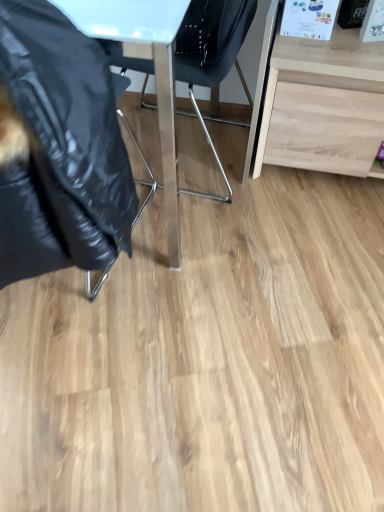
Locate an element on the screen. black glossy jacket at left, which ranks as the 2th chair in right-to-left order is located at coordinates (62, 151).

Looking at this image, does black glossy jacket at left, which ranks as the 2th chair in right-to-left order, have a smaller size compared to metallic blue chair at center, placed as the first chair when sorted from right to left?

Correct, black glossy jacket at left, which ranks as the 2th chair in right-to-left order, occupies less space than metallic blue chair at center, placed as the first chair when sorted from right to left.

Is black glossy jacket at left, which ranks as the 2th chair in right-to-left order, next to metallic blue chair at center, placed as the first chair when sorted from right to left, and touching it?

No, black glossy jacket at left, which ranks as the 2th chair in right-to-left order, is not making contact with metallic blue chair at center, placed as the first chair when sorted from right to left.

Does black glossy jacket at left, the first chair in the left-to-right sequence, have a greater width compared to metallic blue chair at center, placed as the first chair when sorted from right to left?

In fact, black glossy jacket at left, the first chair in the left-to-right sequence, might be narrower than metallic blue chair at center, placed as the first chair when sorted from right to left.

From the image's perspective, is black glossy jacket at left, which ranks as the 2th chair in right-to-left order, under light wood desk at right?

Yes, from the image's perspective, black glossy jacket at left, which ranks as the 2th chair in right-to-left order, is beneath light wood desk at right.

From a real-world perspective, is black glossy jacket at left, which ranks as the 2th chair in right-to-left order, located beneath light wood desk at right?

No, from a real-world perspective, black glossy jacket at left, which ranks as the 2th chair in right-to-left order, is not under light wood desk at right.

Are black glossy jacket at left, the first chair in the left-to-right sequence, and light wood desk at right located far from each other?

Actually, black glossy jacket at left, the first chair in the left-to-right sequence, and light wood desk at right are a little close together.

Considering the sizes of objects black glossy jacket at left, the first chair in the left-to-right sequence, and light wood desk at right in the image provided, who is smaller, black glossy jacket at left, the first chair in the left-to-right sequence, or light wood desk at right?

light wood desk at right is smaller.

Is light wood desk at right located outside black glossy jacket at left, which ranks as the 2th chair in right-to-left order?

Yes, light wood desk at right is located beyond the bounds of black glossy jacket at left, which ranks as the 2th chair in right-to-left order.

Looking at their sizes, would you say light wood desk at right is wider or thinner than black glossy jacket at left, the first chair in the left-to-right sequence?

light wood desk at right is wider than black glossy jacket at left, the first chair in the left-to-right sequence.

Can you tell me how much light wood desk at right and black glossy jacket at left, which ranks as the 2th chair in right-to-left order, differ in facing direction?

179 degrees.

Where is `the 2nd chair to the left when counting from the light wood desk at right`? the 2nd chair to the left when counting from the light wood desk at right is located at coordinates (62, 151).

Is metallic blue chair at center, arranged as the second chair when viewed from the left, inside or outside of light wood desk at right?

The correct answer is: outside.

Which of these two, metallic blue chair at center, placed as the first chair when sorted from right to left, or light wood desk at right, stands shorter?

light wood desk at right is shorter.

In the scene shown: Is the position of metallic blue chair at center, placed as the first chair when sorted from right to left, more distant than that of light wood desk at right?

No, the depth of metallic blue chair at center, placed as the first chair when sorted from right to left, is less than that of light wood desk at right.

Would you say metallic blue chair at center, arranged as the second chair when viewed from the left, is part of light wood desk at right's contents?

No, light wood desk at right does not contain metallic blue chair at center, arranged as the second chair when viewed from the left.

Which object is positioned more to the right, light wood desk at right or metallic blue chair at center, placed as the first chair when sorted from right to left?

light wood desk at right is more to the right.

Considering the relative sizes of light wood desk at right and metallic blue chair at center, placed as the first chair when sorted from right to left, in the image provided, is light wood desk at right thinner than metallic blue chair at center, placed as the first chair when sorted from right to left,?

Yes.

Could you tell me if light wood desk at right is turned towards metallic blue chair at center, placed as the first chair when sorted from right to left?

No, light wood desk at right is not oriented towards metallic blue chair at center, placed as the first chair when sorted from right to left.

From a real-world perspective, between metallic blue chair at center, arranged as the second chair when viewed from the left, and black glossy jacket at left, which ranks as the 2th chair in right-to-left order, who is vertically higher?

From a 3D spatial view, black glossy jacket at left, which ranks as the 2th chair in right-to-left order, is above.

You are a GUI agent. You are given a task and a screenshot of the screen. Output one action in this format:
    pyautogui.click(x=<x>, y=<y>)
    Task: Click on the chair behind the black glossy jacket at left, the first chair in the left-to-right sequence
    
    Given the screenshot: What is the action you would take?
    pyautogui.click(x=212, y=57)

Is metallic blue chair at center, placed as the first chair when sorted from right to left, at the left side of black glossy jacket at left, which ranks as the 2th chair in right-to-left order?

No, metallic blue chair at center, placed as the first chair when sorted from right to left, is not to the left of black glossy jacket at left, which ranks as the 2th chair in right-to-left order.

Is metallic blue chair at center, arranged as the second chair when viewed from the left, far away from black glossy jacket at left, the first chair in the left-to-right sequence?

No.

In order to click on chair on the left of the metallic blue chair at center, placed as the first chair when sorted from right to left in this screenshot , I will do `click(62, 151)`.

The image size is (384, 512). Identify the location of desk located underneath the black glossy jacket at left, which ranks as the 2th chair in right-to-left order (from a real-world perspective). (322, 103).

Considering their positions, is black glossy jacket at left, the first chair in the left-to-right sequence, positioned further to light wood desk at right than metallic blue chair at center, arranged as the second chair when viewed from the left?

black glossy jacket at left, the first chair in the left-to-right sequence, is further to light wood desk at right.

From the image, which object appears to be farther from metallic blue chair at center, placed as the first chair when sorted from right to left, black glossy jacket at left, which ranks as the 2th chair in right-to-left order, or light wood desk at right?

Based on the image, black glossy jacket at left, which ranks as the 2th chair in right-to-left order, appears to be further to metallic blue chair at center, placed as the first chair when sorted from right to left.

When comparing their distances from light wood desk at right, does metallic blue chair at center, placed as the first chair when sorted from right to left, or black glossy jacket at left, which ranks as the 2th chair in right-to-left order, seem further?

black glossy jacket at left, which ranks as the 2th chair in right-to-left order, is positioned further to the anchor light wood desk at right.

Considering their positions, is light wood desk at right positioned closer to black glossy jacket at left, the first chair in the left-to-right sequence, than metallic blue chair at center, placed as the first chair when sorted from right to left?

Based on the image, metallic blue chair at center, placed as the first chair when sorted from right to left, appears to be nearer to black glossy jacket at left, the first chair in the left-to-right sequence.

Looking at the image, which one is located closer to metallic blue chair at center, placed as the first chair when sorted from right to left, light wood desk at right or black glossy jacket at left, the first chair in the left-to-right sequence?

light wood desk at right is positioned closer to the anchor metallic blue chair at center, placed as the first chair when sorted from right to left.

Consider the image. From the image, which object appears to be farther from black glossy jacket at left, which ranks as the 2th chair in right-to-left order, metallic blue chair at center, placed as the first chair when sorted from right to left, or light wood desk at right?

Among the two, light wood desk at right is located further to black glossy jacket at left, which ranks as the 2th chair in right-to-left order.

Where is `chair located between black glossy jacket at left, which ranks as the 2th chair in right-to-left order, and light wood desk at right in the left-right direction`? This screenshot has height=512, width=384. chair located between black glossy jacket at left, which ranks as the 2th chair in right-to-left order, and light wood desk at right in the left-right direction is located at coordinates (212, 57).